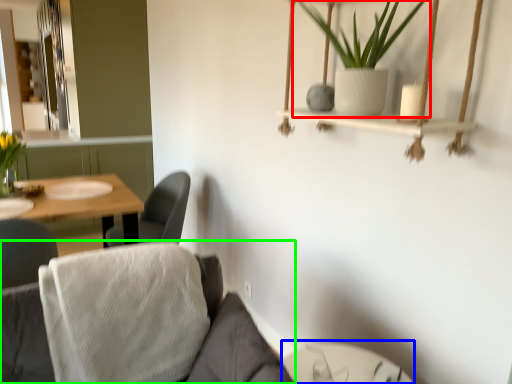
Question: Which object is positioned farthest from houseplant (highlighted by a red box)? Select from glass table (highlighted by a blue box) and couch (highlighted by a green box).

Choices:
 (A) glass table
 (B) couch

Answer: (A)